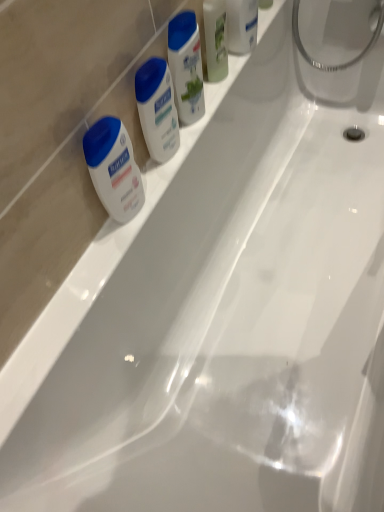
Question: Is white matte lotion at left wider or thinner than translucent plastic soap at upper right, which appears as the fourth toiletry when ordered from the bottom?

Choices:
 (A) wide
 (B) thin

Answer: (B)

Question: Do you think white matte lotion at left is within translucent plastic soap at upper right, which appears as the fourth toiletry when ordered from the bottom, or outside of it?

Choices:
 (A) inside
 (B) outside

Answer: (B)

Question: Based on their relative distances, which object is nearer to the green matte mouthwash at upper center?

Choices:
 (A) translucent plastic soap at upper right, marked as the 1th toiletry in a top-to-bottom arrangement
 (B) white matte lotion at left
 (C) white glossy lotion at upper center, which appears as the second toiletry when ordered from the bottom
 (D) white matte lotion at center, the 1th toiletry positioned from the bottom
 (E) white glossy lotion at upper center, acting as the 2th toiletry starting from the top

Answer: (E)

Question: Which of these objects is positioned farthest from the white matte lotion at center, the 4th toiletry viewed from the top?

Choices:
 (A) green matte mouthwash at upper center
 (B) white matte lotion at left
 (C) white glossy lotion at upper center, positioned as the third toiletry in bottom-to-top order
 (D) translucent plastic soap at upper right, marked as the 1th toiletry in a top-to-bottom arrangement
 (E) white glossy lotion at upper center, the third toiletry from the top

Answer: (D)